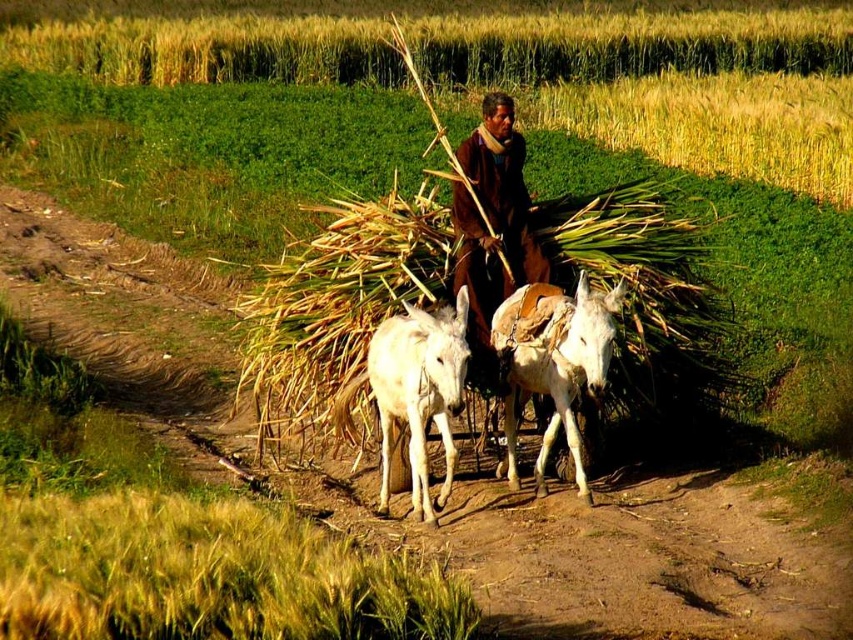
Does brown woolen sweater at center have a greater height compared to white smooth donkey at center?

No, brown woolen sweater at center is not taller than white smooth donkey at center.

Between point (519, 195) and point (415, 456), which one is positioned in front?

Positioned in front is point (415, 456).

This screenshot has height=640, width=853. Find the location of `brown woolen sweater at center`. brown woolen sweater at center is located at coordinates (492, 228).

Where is `brown woolen sweater at center`? The height and width of the screenshot is (640, 853). brown woolen sweater at center is located at coordinates (492, 228).

Does green straw at center appear over white leather donkey at center?

Correct, green straw at center is located above white leather donkey at center.

Can you confirm if green straw at center is thinner than white leather donkey at center?

Incorrect, green straw at center's width is not less than white leather donkey at center's.

Does point (248, 323) lie in front of point (543, 352)?

No.

Locate an element on the screen. green straw at center is located at coordinates (337, 301).

Between green straw at center and white smooth donkey at center, which one appears on the left side from the viewer's perspective?

Positioned to the left is green straw at center.

Between green straw at center and white smooth donkey at center, which one is positioned lower?

Positioned lower is white smooth donkey at center.

Who is more distant from viewer, (466, 195) or (460, 300)?

The point (466, 195) is behind.

This screenshot has width=853, height=640. I want to click on green straw at center, so coord(337,301).